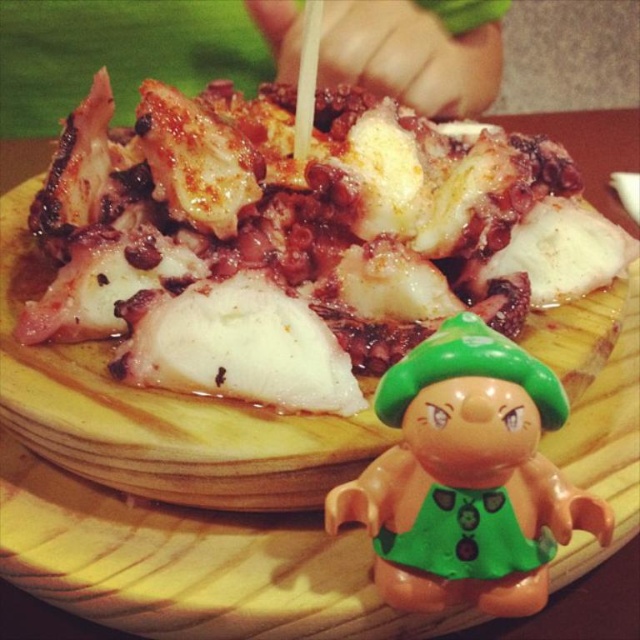
Who is positioned more to the right, slightly charred octopus at center or green plastic toy at lower right?

Positioned to the right is green plastic toy at lower right.

At what (x,y) coordinates should I click in order to perform the action: click on slightly charred octopus at center. Please return your answer as a coordinate pair (x, y). This screenshot has width=640, height=640. Looking at the image, I should click on (298, 240).